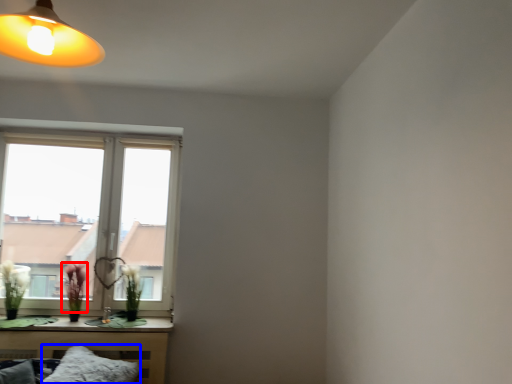
Question: Which object is closer to the camera taking this photo, flower (highlighted by a red box) or pillow (highlighted by a blue box)?

Choices:
 (A) flower
 (B) pillow

Answer: (B)